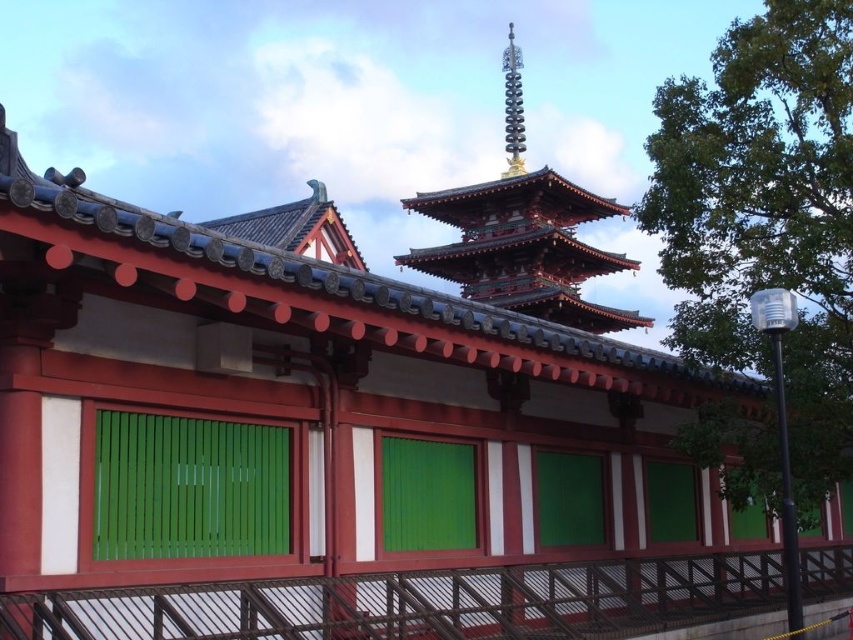
Question: Does green wooden shutter at center appear over green matte shutter at center?

Choices:
 (A) yes
 (B) no

Answer: (A)

Question: Which object appears farthest from the camera in this image?

Choices:
 (A) green wooden slats at center
 (B) metallic spire at upper center

Answer: (B)

Question: Is green wooden slats at center below green matte shutter at center?

Choices:
 (A) no
 (B) yes

Answer: (A)

Question: From the image, what is the correct spatial relationship of green wooden slats at center in relation to metallic spire at upper center?

Choices:
 (A) below
 (B) above

Answer: (A)

Question: Which point appears closest to the camera in this image?

Choices:
 (A) (517, 138)
 (B) (641, 323)
 (C) (550, 545)

Answer: (C)

Question: Among these points, which one is nearest to the camera?

Choices:
 (A) (152, 493)
 (B) (432, 452)
 (C) (561, 269)

Answer: (A)